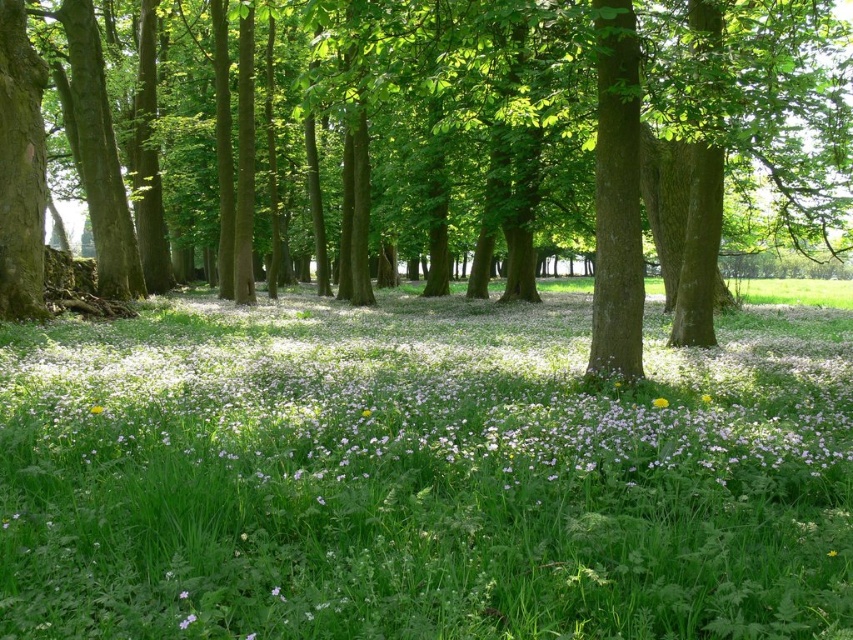
Is green grassy at center above green leafy tree at center?

Actually, green grassy at center is below green leafy tree at center.

Can you confirm if green grassy at center is shorter than green leafy tree at center?

Yes, green grassy at center is shorter than green leafy tree at center.

Between point (821, 554) and point (676, 332), which one is positioned behind?

Positioned behind is point (676, 332).

Where is `green grassy at center`? This screenshot has width=853, height=640. green grassy at center is located at coordinates (421, 476).

Is white matte flowers at center shorter than yellow matte flower at center?

No.

Is white matte flowers at center thinner than yellow matte flower at center?

In fact, white matte flowers at center might be wider than yellow matte flower at center.

Which is behind, point (573, 358) or point (654, 400)?

The point (573, 358) is behind.

Locate an element on the screen. white matte flowers at center is located at coordinates (416, 410).

Does point (514, 51) lie behind point (660, 406)?

Yes, point (514, 51) is behind point (660, 406).

Does point (460, 193) come farther from viewer compared to point (660, 406)?

Yes, point (460, 193) is farther from viewer.

Find the location of a particular element. green leafy tree at center is located at coordinates (521, 138).